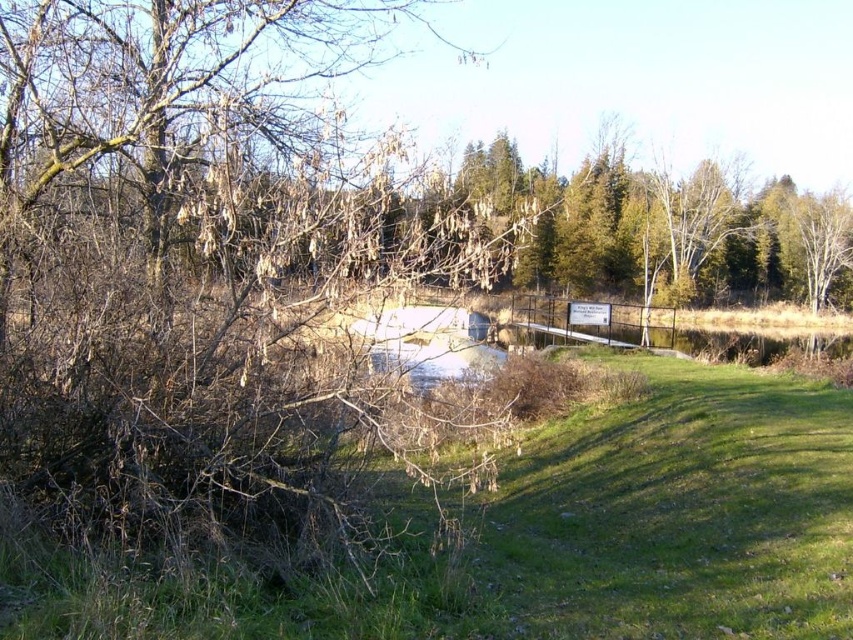
You are standing at the edge of the water and want to walk towards the green textured tree at upper center. Which direction should you look to see the green grass at lower right?

The green grass at lower right is located to your right side when facing the green textured tree at upper center, so you should turn your head to the right to see it.

You are standing at the edge of the water and want to walk towards the green textured tree at upper center. Which direction should you head relative to the green grass at lower right?

You should head to the right of the green grass at lower right because the green textured tree at upper center is located to the right of the green grass at lower right.